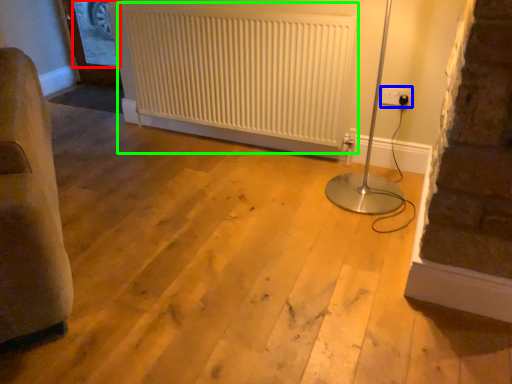
Question: Estimate the real-world distances between objects in this image. Which object is closer to window screen (highlighted by a red box), electric outlet (highlighted by a blue box) or radiator (highlighted by a green box)?

Choices:
 (A) electric outlet
 (B) radiator

Answer: (B)